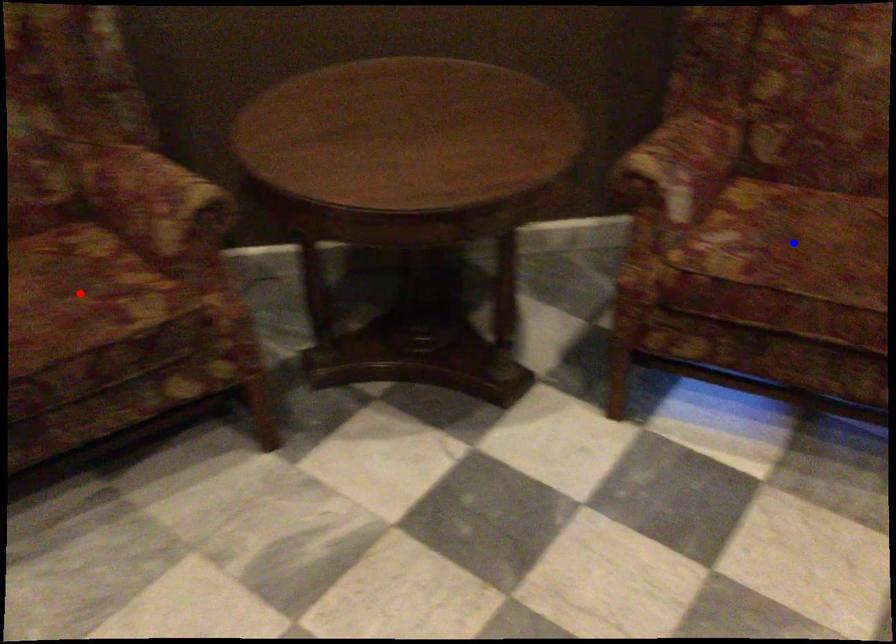
Question: Which of the two points in the image is closer to the camera?

Choices:
 (A) Blue point is closer.
 (B) Red point is closer.

Answer: (B)